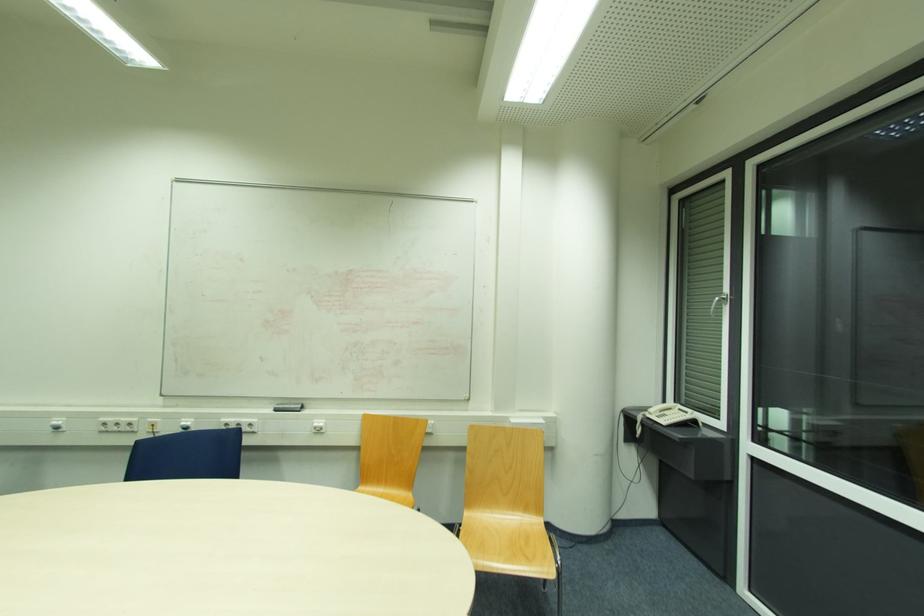
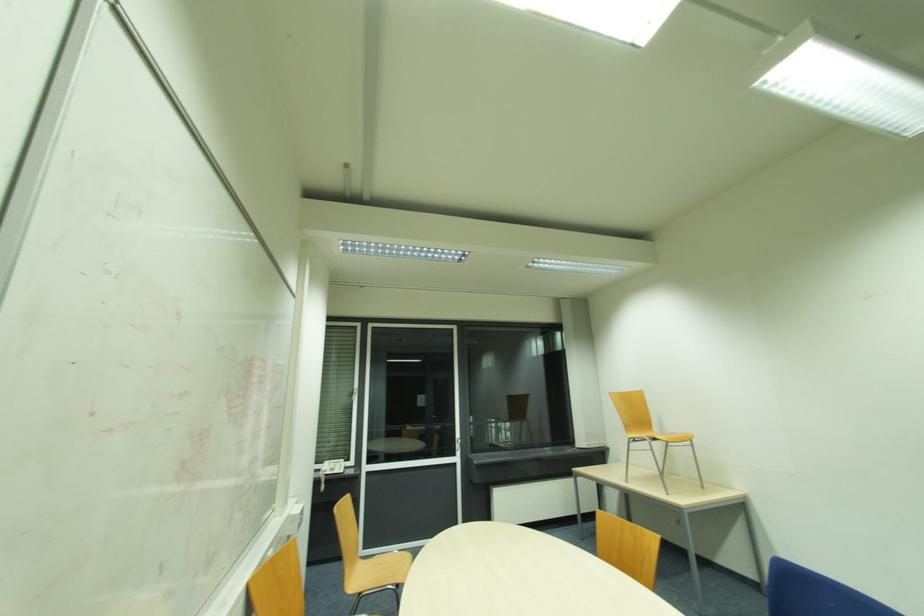
Find the pixel in the second image that matches the point at 727,291 in the first image.

(358, 386)